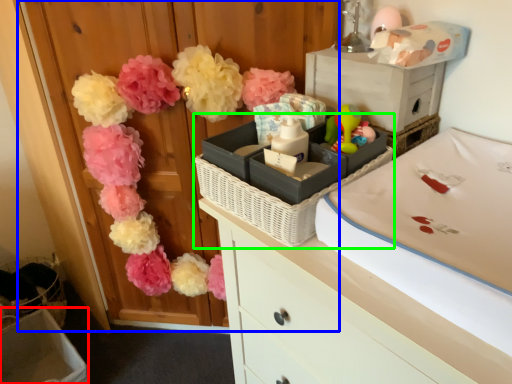
Question: Based on their relative distances, which object is farther from storage box (highlighted by a red box)? Choose from armoire (highlighted by a blue box) and basket container (highlighted by a green box).

Choices:
 (A) armoire
 (B) basket container

Answer: (B)